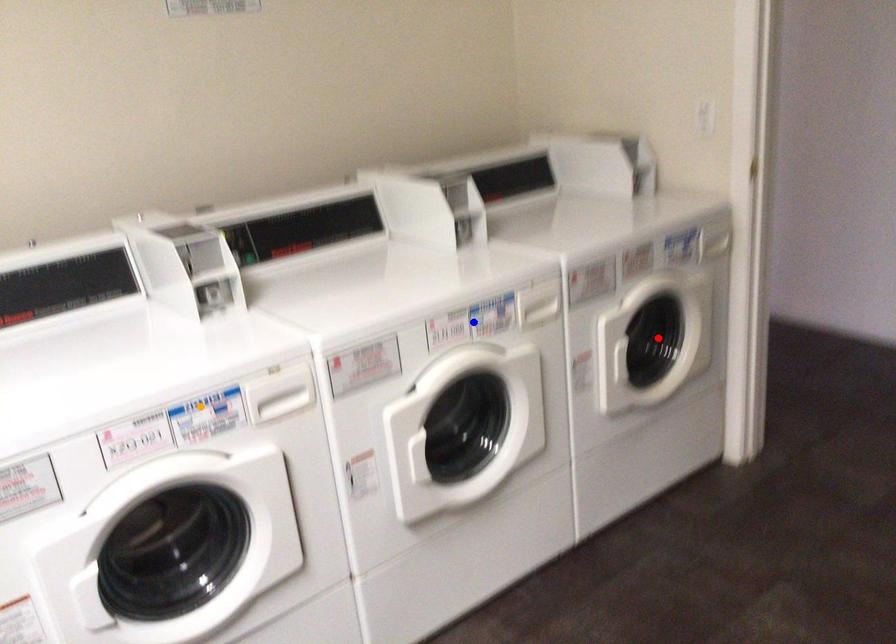
Order these from farthest to nearest:
red point, orange point, blue point

red point, blue point, orange point